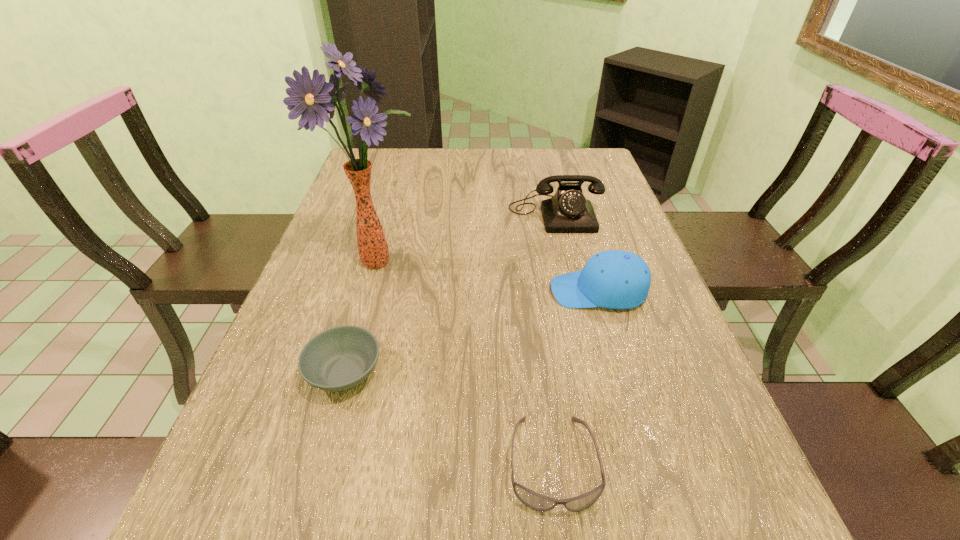
Locate an element on the screen. The image size is (960, 540). object that can be found as the second closest to the nearest object is located at coordinates (613, 279).

Locate which object is the third closest to the farthest object. Please provide its 2D coordinates. Your answer should be formatted as a tuple, i.e. [(x, y)], where the tuple contains the x and y coordinates of a point satisfying the conditions above.

[(339, 358)]